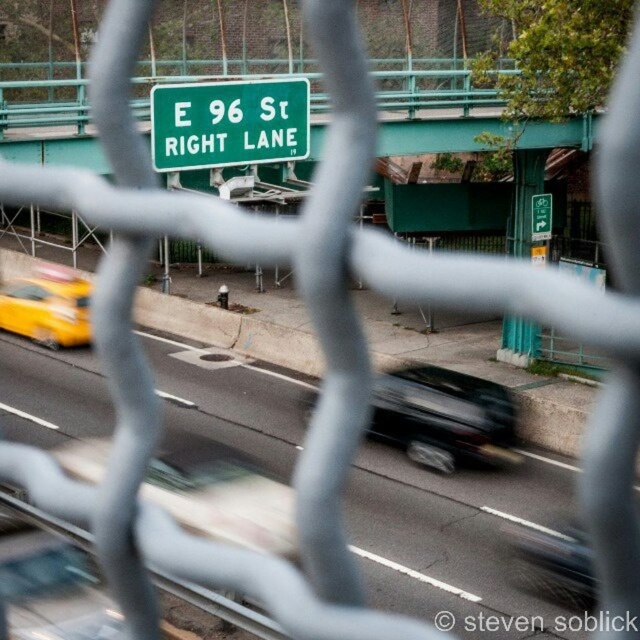
Question: Among these objects, which one is nearest to the camera?

Choices:
 (A) green metal sign at upper center
 (B) green plastic parking sign at upper center

Answer: (A)

Question: Is yellow rubber taxi at left bigger than green plastic parking sign at upper center?

Choices:
 (A) no
 (B) yes

Answer: (B)

Question: Does black rubber car at right lane appear on the left side of green plastic parking sign at upper center?

Choices:
 (A) yes
 (B) no

Answer: (A)

Question: Which of the following is the farthest from the observer?

Choices:
 (A) green metal sign at upper center
 (B) shiny black sedan at center
 (C) green matte sign at upper center
 (D) yellow rubber taxi at left

Answer: (D)

Question: Does green metal sign at upper center appear on the left side of shiny black sedan at center?

Choices:
 (A) no
 (B) yes

Answer: (B)

Question: Which of the following is the closest to the observer?

Choices:
 (A) (545, 204)
 (B) (232, 448)
 (C) (40, 337)
 (D) (408, 388)

Answer: (B)